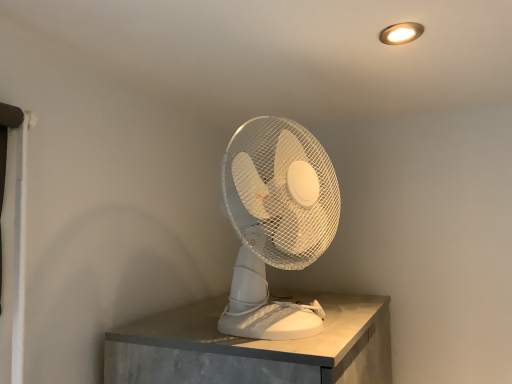
This screenshot has width=512, height=384. I want to click on vacant area that is in front of matte gold light fixture at upper right, so (409, 11).